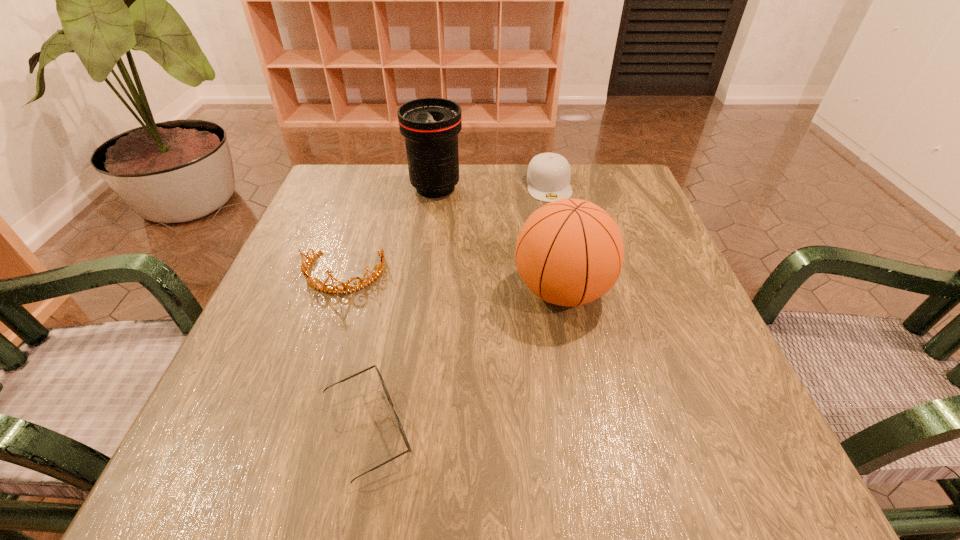
Locate an element on the screen. vacant space located 0.110m with the lenses facing outward on the nearest object is located at coordinates (492, 430).

Identify the location of telephoto lens situated at the far edge. (430, 126).

Identify the location of cap that is at the far edge. (548, 177).

Image resolution: width=960 pixels, height=540 pixels. I want to click on object present at the near edge, so click(379, 375).

Identify the location of object at the left edge. (346, 288).

I want to click on object present at the right edge, so tap(569, 252).

In the image, there is a desktop. Where is `vacant region at the far edge`? vacant region at the far edge is located at coordinates (385, 189).

Where is `free location at the near edge`? Image resolution: width=960 pixels, height=540 pixels. free location at the near edge is located at coordinates (469, 490).

Image resolution: width=960 pixels, height=540 pixels. What are the coordinates of `vacant region at the left edge of the desktop` in the screenshot? It's located at (234, 365).

The width and height of the screenshot is (960, 540). In the image, there is a desktop. Find the location of `free region at the right edge`. free region at the right edge is located at coordinates pyautogui.click(x=728, y=380).